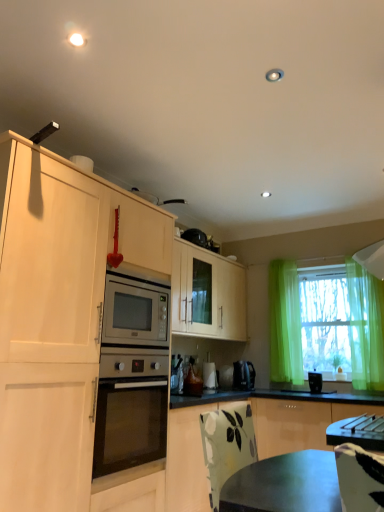
Question: Is white glossy coffee maker at lower center, which is the 2th appliance from right to left, looking in the opposite direction of black plastic toaster at right, which is the first appliance in right-to-left order?

Choices:
 (A) no
 (B) yes

Answer: (A)

Question: From a real-world perspective, is white glossy coffee maker at lower center, the third appliance in the front-to-back sequence, beneath black plastic toaster at right, acting as the 1th appliance starting from the front?

Choices:
 (A) yes
 (B) no

Answer: (B)

Question: Does white glossy coffee maker at lower center, which is the first appliance in back-to-front order, have a greater height compared to black plastic toaster at right, the third appliance from the back?

Choices:
 (A) no
 (B) yes

Answer: (B)

Question: From a real-world perspective, is white glossy coffee maker at lower center, which is the first appliance in back-to-front order, over black plastic toaster at right, marked as the third appliance in a left-to-right arrangement?

Choices:
 (A) no
 (B) yes

Answer: (B)

Question: Considering the relative sizes of white glossy coffee maker at lower center, which is the first appliance in back-to-front order, and black plastic toaster at right, which is the first appliance in right-to-left order, in the image provided, is white glossy coffee maker at lower center, which is the first appliance in back-to-front order, smaller than black plastic toaster at right, which is the first appliance in right-to-left order,?

Choices:
 (A) no
 (B) yes

Answer: (A)

Question: From the image's perspective, relative to white glossy coffee maker at lower center, which is counted as the second appliance, starting from the left, is black plastic toaster at right, acting as the 1th appliance starting from the front, above or below?

Choices:
 (A) above
 (B) below

Answer: (B)

Question: Choose the correct answer: Is black plastic toaster at right, the third appliance from the back, inside white glossy coffee maker at lower center, the third appliance in the front-to-back sequence, or outside it?

Choices:
 (A) outside
 (B) inside

Answer: (A)

Question: Considering the positions of black plastic toaster at right, which is the first appliance in right-to-left order, and white glossy coffee maker at lower center, which is the 2th appliance from right to left, in the image, is black plastic toaster at right, which is the first appliance in right-to-left order, taller or shorter than white glossy coffee maker at lower center, which is the 2th appliance from right to left,?

Choices:
 (A) short
 (B) tall

Answer: (A)

Question: From a real-world perspective, relative to white glossy coffee maker at lower center, the third appliance in the front-to-back sequence, is black plastic toaster at right, marked as the third appliance in a left-to-right arrangement, vertically above or below?

Choices:
 (A) below
 (B) above

Answer: (A)

Question: In terms of height, does green sheer curtain at right look taller or shorter compared to green matte cabinet at lower right?

Choices:
 (A) tall
 (B) short

Answer: (A)

Question: Is point (377, 385) closer or farther from the camera than point (205, 479)?

Choices:
 (A) farther
 (B) closer

Answer: (A)

Question: Is green sheer curtain at right spatially inside green matte cabinet at lower right, or outside of it?

Choices:
 (A) outside
 (B) inside

Answer: (A)

Question: In terms of width, does green sheer curtain at right look wider or thinner when compared to green matte cabinet at lower right?

Choices:
 (A) wide
 (B) thin

Answer: (B)

Question: From a real-world perspective, is green matte cabinet at lower right physically located above or below translucent green curtain at right?

Choices:
 (A) below
 (B) above

Answer: (A)

Question: Is green matte cabinet at lower right in front of or behind translucent green curtain at right in the image?

Choices:
 (A) behind
 (B) front

Answer: (B)